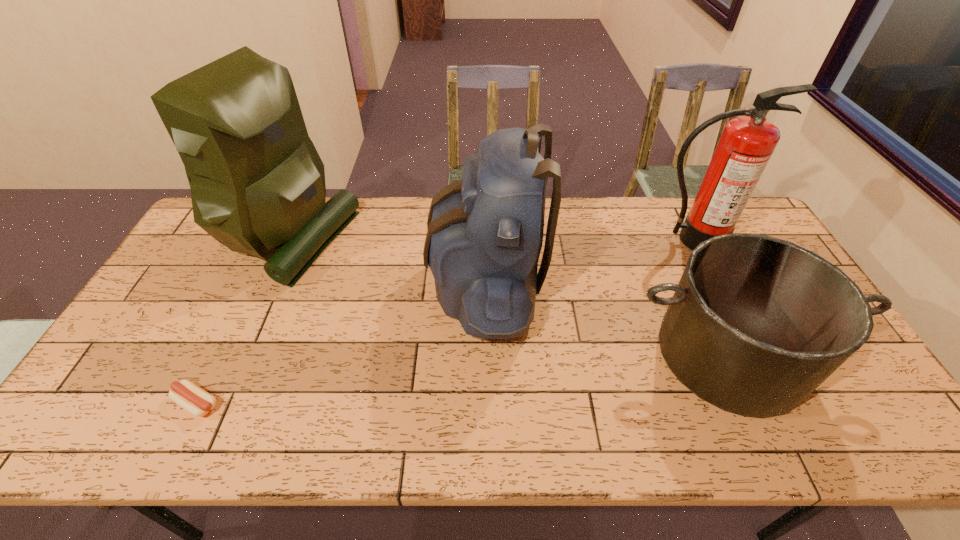
Where is `the left backpack`? The width and height of the screenshot is (960, 540). the left backpack is located at coordinates (257, 182).

Where is `fire extinguisher`? fire extinguisher is located at coordinates (746, 145).

Find the location of `the third object from right to left`. the third object from right to left is located at coordinates (485, 232).

Find the location of a particular element. Image resolution: width=960 pixels, height=540 pixels. pan is located at coordinates (756, 324).

The height and width of the screenshot is (540, 960). What are the coordinates of `the shortest object` in the screenshot? It's located at (186, 394).

Where is `free region located on the front of the left backpack with visible pockets`? free region located on the front of the left backpack with visible pockets is located at coordinates (468, 238).

Find the location of `free space located 0.220m on the front-facing side of the fire extinguisher`. free space located 0.220m on the front-facing side of the fire extinguisher is located at coordinates (726, 307).

The image size is (960, 540). I want to click on vacant space located 0.270m at the front pocket of the third object from left to right, so click(341, 284).

At what (x,y) coordinates should I click in order to perform the action: click on free space located 0.390m at the front pocket of the third object from left to right. Please return your answer as a coordinate pair (x, y). Looking at the image, I should click on (300, 284).

Where is `free region located 0.080m at the front pocket of the third object from left to right`? The height and width of the screenshot is (540, 960). free region located 0.080m at the front pocket of the third object from left to right is located at coordinates (404, 284).